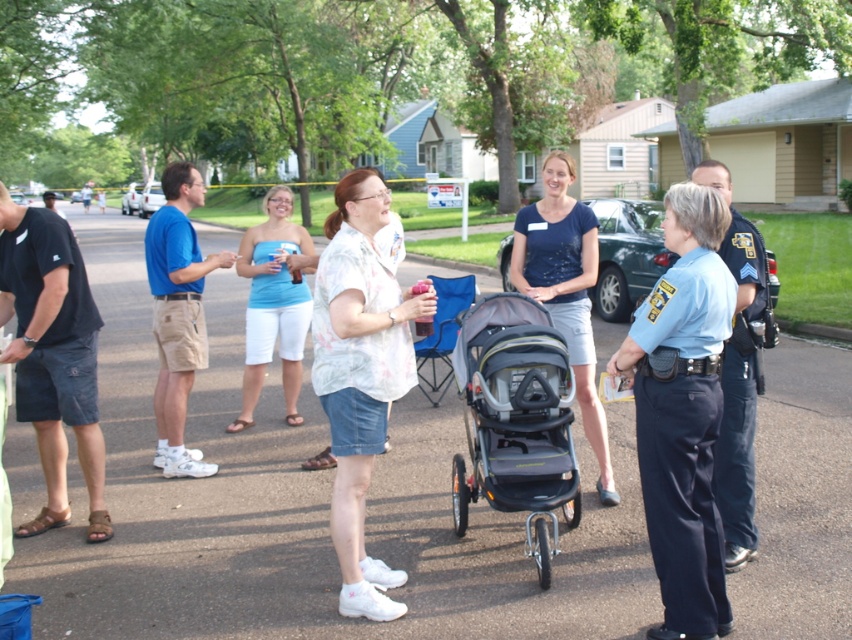
Can you confirm if dark blue jersey at center is taller than blue uniform at right?

In fact, dark blue jersey at center may be shorter than blue uniform at right.

Between point (534, 260) and point (740, 552), which one is positioned behind?

Positioned behind is point (534, 260).

Where is `dark blue jersey at center`? The width and height of the screenshot is (852, 640). dark blue jersey at center is located at coordinates (565, 289).

Is floral shirt at center closer to the viewer compared to matte blue tank top at center?

Yes.

Which of these two, floral shirt at center or matte blue tank top at center, stands shorter?

matte blue tank top at center

Does point (338, 243) come in front of point (240, 424)?

Yes, it is in front of point (240, 424).

Find the location of a particular element. This screenshot has height=640, width=852. floral shirt at center is located at coordinates (360, 376).

Who is shorter, gray fabric stroller at center or black fabric uniform at left?

With less height is gray fabric stroller at center.

Is gray fabric stroller at center shorter than black fabric uniform at left?

Correct, gray fabric stroller at center is not as tall as black fabric uniform at left.

Who is more distant from viewer, (562, 476) or (73, 432)?

The point (73, 432) is more distant.

Locate an element on the screen. Image resolution: width=852 pixels, height=640 pixels. gray fabric stroller at center is located at coordinates 516,419.